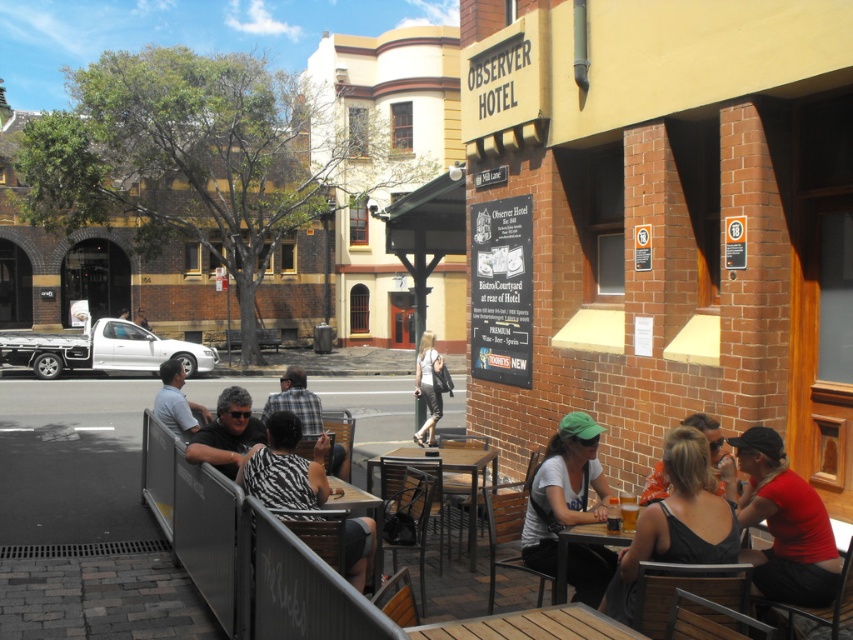
Can you confirm if black fabric tank top at lower right is wider than matte white t-shirt at lower center?

No.

Between point (706, 545) and point (572, 560), which one is positioned in front?

Point (706, 545) is more forward.

Identify the location of black fabric tank top at lower right. (677, 522).

Between plaid shirt at center and orange fabric shirt at center, which one appears on the left side from the viewer's perspective?

plaid shirt at center

Which of these two, plaid shirt at center or orange fabric shirt at center, stands taller?

plaid shirt at center

Does point (302, 412) come behind point (730, 474)?

Yes, it is.

Image resolution: width=853 pixels, height=640 pixels. Find the location of `plaid shirt at center`. plaid shirt at center is located at coordinates (296, 401).

Is zebra-patterned shirt at center shorter than wooden slats table at lower center?

In fact, zebra-patterned shirt at center may be taller than wooden slats table at lower center.

Consider the image. Between zebra-patterned shirt at center and wooden slats table at lower center, which one appears on the right side from the viewer's perspective?

wooden slats table at lower center is more to the right.

Who is more distant from viewer, (x=289, y=456) or (x=543, y=628)?

The point (x=289, y=456) is behind.

The image size is (853, 640). I want to click on zebra-patterned shirt at center, so click(285, 467).